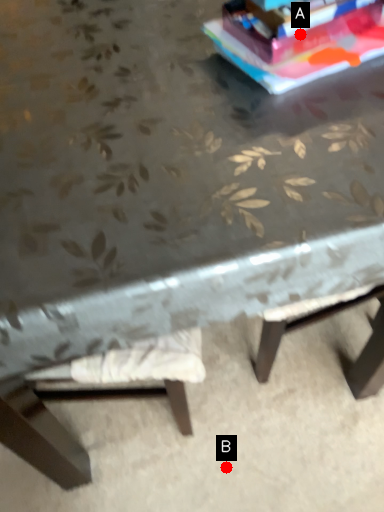
Question: Two points are circled on the image, labeled by A and B beside each circle. Which point appears farthest from the camera in this image?

Choices:
 (A) A is further
 (B) B is further

Answer: (B)